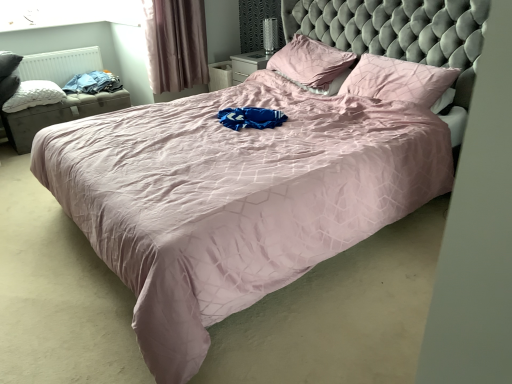
What do you see at coordinates (67, 13) in the screenshot? I see `transparent glass window screen at upper left` at bounding box center [67, 13].

Identify the location of white matte radiator at left. (60, 64).

At what (x,y) coordinates should I click in order to perform the action: click on pink fabric pillow at center, positioned as the second pillow in right-to-left order. Please return your answer as a coordinate pair (x, y). This screenshot has width=512, height=384. Looking at the image, I should click on (312, 64).

Consider the image. In order to face pink fabric curtain at upper left, should I rotate leftwards or rightwards?

Rotate left and turn 10.356 degrees.

Where is `pink fabric pillow at upper right, the first pillow when ordered from right to left`? This screenshot has height=384, width=512. pink fabric pillow at upper right, the first pillow when ordered from right to left is located at coordinates (398, 80).

Is blue cotton shirt at left to the right of matte gray storage ottoman at left from the viewer's perspective?

Yes, blue cotton shirt at left is to the right of matte gray storage ottoman at left.

Which of these two, blue cotton shirt at left or matte gray storage ottoman at left, stands taller?

Standing taller between the two is matte gray storage ottoman at left.

The image size is (512, 384). Identify the location of bed frame to the left of blue cotton shirt at left. (58, 115).

From a real-world perspective, relative to matte gray storage ottoman at left, is blue cotton shirt at left vertically above or below?

Clearly, from a real-world perspective, blue cotton shirt at left is above matte gray storage ottoman at left.

Would you say matte gray storage ottoman at left is a long distance from pink fabric curtain at upper left?

No.

From a real-world perspective, is matte gray storage ottoman at left physically above pink fabric curtain at upper left?

No.

Who is smaller, matte gray storage ottoman at left or pink fabric curtain at upper left?

With smaller size is pink fabric curtain at upper left.

Is point (20, 148) more distant than point (180, 87)?

No, (20, 148) is closer to viewer.

Is white matte radiator at left oriented away from matte gray storage ottoman at left?

No, matte gray storage ottoman at left is not at the back of white matte radiator at left.

Considering the sizes of white matte radiator at left and matte gray storage ottoman at left in the image, is white matte radiator at left bigger or smaller than matte gray storage ottoman at left?

Clearly, white matte radiator at left is smaller in size than matte gray storage ottoman at left.

From a real-world perspective, who is located higher, white matte radiator at left or matte gray storage ottoman at left?

white matte radiator at left.

Is transparent glass window screen at upper left taller or shorter than pink fabric curtain at upper left?

In the image, transparent glass window screen at upper left appears to be shorter than pink fabric curtain at upper left.

Looking at their sizes, would you say transparent glass window screen at upper left is wider or thinner than pink fabric curtain at upper left?

Considering their sizes, transparent glass window screen at upper left looks slimmer than pink fabric curtain at upper left.

From the image's perspective, who appears lower, transparent glass window screen at upper left or pink fabric curtain at upper left?

pink fabric curtain at upper left, from the image's perspective.

Which object is further away from the camera taking this photo, transparent glass window screen at upper left or pink fabric curtain at upper left?

transparent glass window screen at upper left is further from the camera.

From the image's perspective, is pink fabric curtain at upper left located beneath blue cotton shirt at left?

No.

Which object is further away from the camera, pink fabric curtain at upper left or blue cotton shirt at left?

blue cotton shirt at left is more distant.

From a real-world perspective, between pink fabric curtain at upper left and blue cotton shirt at left, who is vertically higher?

From a 3D spatial view, pink fabric curtain at upper left is above.

Which is more to the left, pink fabric curtain at upper left or blue cotton shirt at left?

blue cotton shirt at left.

At what (x,y) coordinates should I click in order to perform the action: click on clothing to the right of white quilted pillow at left, marked as the first pillow in a left-to-right arrangement. Please return your answer as a coordinate pair (x, y). This screenshot has width=512, height=384. Looking at the image, I should click on (93, 83).

Does white quilted pillow at left, the 3th pillow when ordered from right to left, contain blue cotton shirt at left?

No, white quilted pillow at left, the 3th pillow when ordered from right to left, does not contain blue cotton shirt at left.

From the image's perspective, between white quilted pillow at left, the 3th pillow when ordered from right to left, and blue cotton shirt at left, who is located below?

From the image's view, white quilted pillow at left, the 3th pillow when ordered from right to left, is below.

Are white quilted pillow at left, marked as the first pillow in a left-to-right arrangement, and blue cotton shirt at left located far from each other?

They are positioned close to each other.

From the image's perspective, is transparent glass window screen at upper left above or below pink fabric pillow at upper right, which is counted as the third pillow, starting from the left?

Clearly, from the image's perspective, transparent glass window screen at upper left is above pink fabric pillow at upper right, which is counted as the third pillow, starting from the left.

Between point (0, 20) and point (390, 85), which one is positioned in front?

The point (390, 85) is more forward.

Is there a large distance between transparent glass window screen at upper left and pink fabric pillow at upper right, which is counted as the third pillow, starting from the left?

Yes, transparent glass window screen at upper left and pink fabric pillow at upper right, which is counted as the third pillow, starting from the left, are quite far apart.

At what (x,y) coordinates should I click in order to perform the action: click on clothing above the matte gray storage ottoman at left (from the image's perspective). Please return your answer as a coordinate pair (x, y). The image size is (512, 384). Looking at the image, I should click on (93, 83).

At what (x,y) coordinates should I click in order to perform the action: click on curtain located behind the matte gray storage ottoman at left. Please return your answer as a coordinate pair (x, y). This screenshot has height=384, width=512. Looking at the image, I should click on (175, 44).

When comparing their distances from pink fabric pillow at upper right, the first pillow when ordered from right to left, does matte gray storage ottoman at left or pink fabric pillow at center, arranged as the 2th pillow when viewed from the left, seem closer?

pink fabric pillow at center, arranged as the 2th pillow when viewed from the left, lies closer to pink fabric pillow at upper right, the first pillow when ordered from right to left, than the other object.

Based on their spatial positions, is blue cotton shirt at left or matte gray storage ottoman at left further from white quilted pillow at left, marked as the first pillow in a left-to-right arrangement?

blue cotton shirt at left is positioned further to the anchor white quilted pillow at left, marked as the first pillow in a left-to-right arrangement.

Based on the photo, from the image, which object appears to be farther from pink fabric curtain at upper left, pink fabric pillow at center, positioned as the second pillow in right-to-left order, or matte gray storage ottoman at left?

pink fabric pillow at center, positioned as the second pillow in right-to-left order, is positioned further to the anchor pink fabric curtain at upper left.

Based on the photo, from the image, which object appears to be nearer to pink fabric pillow at center, positioned as the second pillow in right-to-left order, blue cotton shirt at left or pink fabric curtain at upper left?

The object closer to pink fabric pillow at center, positioned as the second pillow in right-to-left order, is pink fabric curtain at upper left.

Looking at the image, which one is located closer to transparent glass window screen at upper left, pink fabric pillow at center, arranged as the 2th pillow when viewed from the left, or blue cotton shirt at left?

blue cotton shirt at left is closer to transparent glass window screen at upper left.

Based on their spatial positions, is white matte radiator at left or transparent glass window screen at upper left closer to blue cotton shirt at left?

Among the two, white matte radiator at left is located nearer to blue cotton shirt at left.

Based on their spatial positions, is white quilted pillow at left, marked as the first pillow in a left-to-right arrangement, or blue cotton shirt at left further from transparent glass window screen at upper left?

Based on the image, white quilted pillow at left, marked as the first pillow in a left-to-right arrangement, appears to be further to transparent glass window screen at upper left.

Considering their positions, is white matte radiator at left positioned further to blue cotton shirt at left than white quilted pillow at left, the 3th pillow when ordered from right to left?

Based on the image, white matte radiator at left appears to be further to blue cotton shirt at left.

Locate an element on the screen. clothing situated between white quilted pillow at left, marked as the first pillow in a left-to-right arrangement, and pink fabric curtain at upper left from left to right is located at coordinates (93, 83).

At what (x,y) coordinates should I click in order to perform the action: click on clothing located between white matte radiator at left and pink fabric pillow at upper right, the first pillow when ordered from right to left, in the left-right direction. Please return your answer as a coordinate pair (x, y). This screenshot has width=512, height=384. Looking at the image, I should click on (93, 83).

Find the location of `curtain situated between white matte radiator at left and pink fabric pillow at center, arranged as the 2th pillow when viewed from the left, from left to right`. curtain situated between white matte radiator at left and pink fabric pillow at center, arranged as the 2th pillow when viewed from the left, from left to right is located at coordinates (175, 44).

Where is `curtain between transparent glass window screen at upper left and pink fabric pillow at upper right, the first pillow when ordered from right to left, in the horizontal direction`? curtain between transparent glass window screen at upper left and pink fabric pillow at upper right, the first pillow when ordered from right to left, in the horizontal direction is located at coordinates (175, 44).